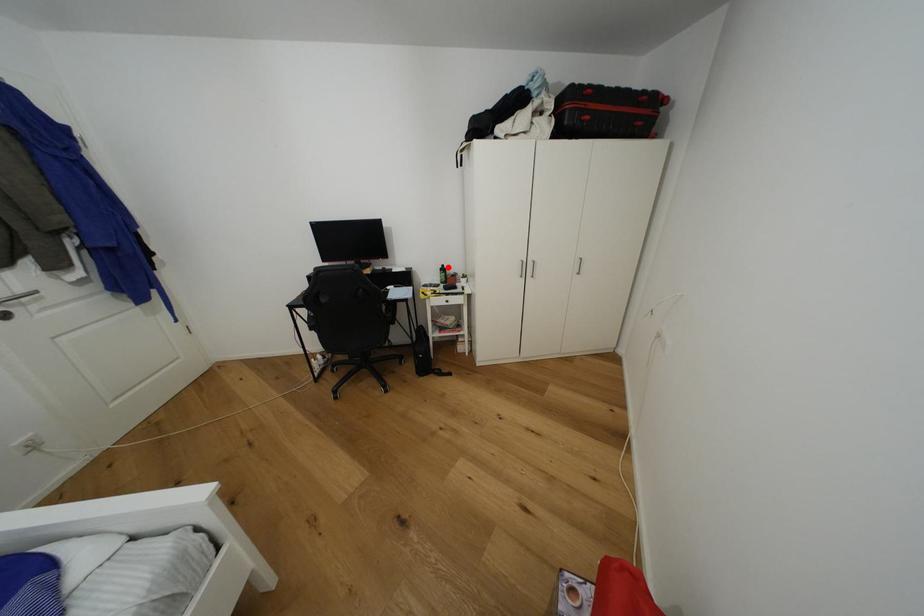
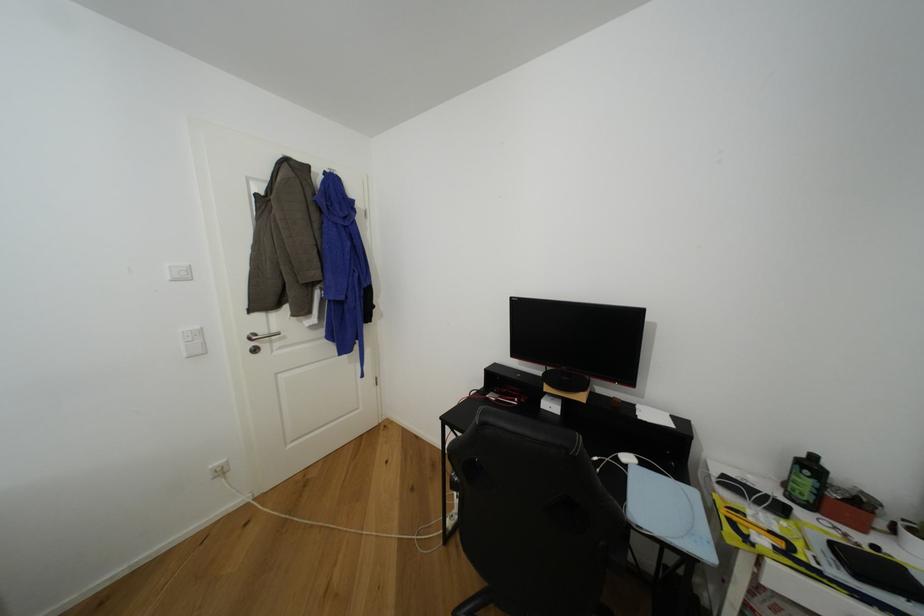
In the second image, find the point that corresponds to the highlighted location in the first image.

(820, 459)